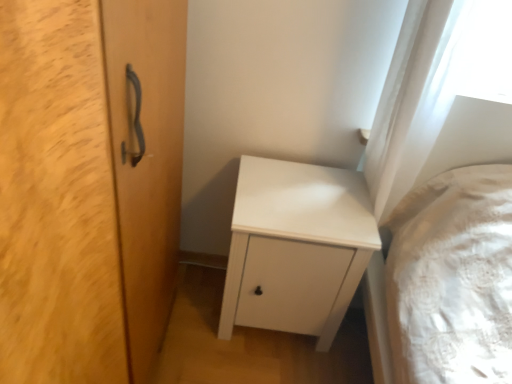
Identify the location of vacant area on top of white matte nightstand at center (from a real-world perspective). (298, 199).